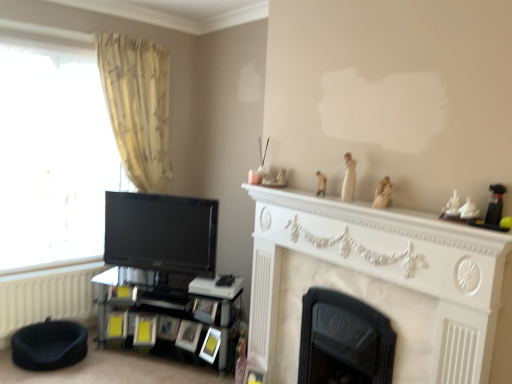
The height and width of the screenshot is (384, 512). In order to click on dark blue fabric bean bag chair at lower left in this screenshot , I will do `click(49, 345)`.

What is the approximate height of white textured radiator at lower left?

It is 17.04 inches.

Image resolution: width=512 pixels, height=384 pixels. What do you see at coordinates (48, 297) in the screenshot?
I see `white textured radiator at lower left` at bounding box center [48, 297].

Where is `beige textured curtain at left`? The height and width of the screenshot is (384, 512). beige textured curtain at left is located at coordinates (138, 106).

Measure the distance between beige textured curtain at left and camera.

beige textured curtain at left and camera are 2.94 meters apart.

At what (x,y) coordinates should I click in order to perform the action: click on white glossy statue at upper center, which is counted as the second toy, starting from the right. Please return your answer as a coordinate pair (x, y). The width and height of the screenshot is (512, 384). Looking at the image, I should click on (349, 178).

What are the coordinates of `dark blue fabric bean bag chair at lower left` in the screenshot? It's located at (49, 345).

How far apart are matte white figurine at upper center, placed as the first toy when sorted from back to front, and transparent glass window at left?

6.70 feet.

From the image's perspective, is matte white figurine at upper center, the third toy from the right, above transparent glass window at left?

No.

Which of these two, matte white figurine at upper center, the third toy from the right, or transparent glass window at left, is smaller?

Smaller between the two is matte white figurine at upper center, the third toy from the right.

Is matte white figurine at upper center, placed as the first toy when sorted from back to front, placed right next to transparent glass window at left?

matte white figurine at upper center, placed as the first toy when sorted from back to front, is not next to transparent glass window at left, and they're not touching.

Consider the image. Can you confirm if black glossy shelf at lower left is smaller than white marble fireplace at upper center?

No, black glossy shelf at lower left is not smaller than white marble fireplace at upper center.

Considering the relative sizes of black glossy shelf at lower left and white marble fireplace at upper center in the image provided, is black glossy shelf at lower left taller than white marble fireplace at upper center?

Indeed, black glossy shelf at lower left has a greater height compared to white marble fireplace at upper center.

From the image's perspective, which one is positioned lower, black glossy shelf at lower left or white marble fireplace at upper center?

black glossy shelf at lower left is shown below in the image.

Can you confirm if black glossy shelf at lower left is positioned to the right of white marble fireplace at upper center?

Incorrect, black glossy shelf at lower left is not on the right side of white marble fireplace at upper center.

Between white porcelain figurine at upper right and black glossy shelf at lower left, which one appears on the left side from the viewer's perspective?

From the viewer's perspective, black glossy shelf at lower left appears more on the left side.

From the image's perspective, is white porcelain figurine at upper right positioned above or below black glossy shelf at lower left?

white porcelain figurine at upper right is above black glossy shelf at lower left.

Does white porcelain figurine at upper right have a larger size compared to black glossy shelf at lower left?

Actually, white porcelain figurine at upper right might be smaller than black glossy shelf at lower left.

Is white porcelain figurine at upper right situated inside black glossy shelf at lower left or outside?

white porcelain figurine at upper right is outside black glossy shelf at lower left.

Locate an element on the screen. bean bag chair in front of the matte white picture frame at lower center, which is counted as the 1th picture frame, starting from the left is located at coordinates (49, 345).

Is dark blue fabric bean bag chair at lower left not close to matte white picture frame at lower center, which ranks as the first picture frame in back-to-front order?

They are positioned close to each other.

Do you think dark blue fabric bean bag chair at lower left is within matte white picture frame at lower center, which is counted as the 1th picture frame, starting from the left, or outside of it?

dark blue fabric bean bag chair at lower left is spatially situated outside matte white picture frame at lower center, which is counted as the 1th picture frame, starting from the left.

Between white textured radiator at lower left and white marble fireplace at center, marked as the second fireplace in a back-to-front arrangement, which one has less height?

Standing shorter between the two is white textured radiator at lower left.

Can you confirm if white textured radiator at lower left is thinner than white marble fireplace at center, which is the first fireplace in front-to-back order?

Yes, white textured radiator at lower left is thinner than white marble fireplace at center, which is the first fireplace in front-to-back order.

Is white textured radiator at lower left not inside white marble fireplace at center, which is the first fireplace in front-to-back order?

white textured radiator at lower left lies outside white marble fireplace at center, which is the first fireplace in front-to-back order,'s area.

Which object is closer to the camera taking this photo, white textured radiator at lower left or white marble fireplace at center, marked as the second fireplace in a back-to-front arrangement?

white marble fireplace at center, marked as the second fireplace in a back-to-front arrangement, is more forward.

Does matte white figurine at upper center, the third toy from the right, have a lesser width compared to white marble fireplace at center, marked as the second fireplace in a back-to-front arrangement?

Indeed, matte white figurine at upper center, the third toy from the right, has a lesser width compared to white marble fireplace at center, marked as the second fireplace in a back-to-front arrangement.

From the picture: Considering the sizes of objects matte white figurine at upper center, arranged as the 1th toy when viewed from the left, and white marble fireplace at center, marked as the second fireplace in a back-to-front arrangement, in the image provided, who is smaller, matte white figurine at upper center, arranged as the 1th toy when viewed from the left, or white marble fireplace at center, marked as the second fireplace in a back-to-front arrangement,?

With smaller size is matte white figurine at upper center, arranged as the 1th toy when viewed from the left.

Is matte white figurine at upper center, which is counted as the 3th toy, starting from the front, looking in the opposite direction of white marble fireplace at center, which is the first fireplace in front-to-back order?

matte white figurine at upper center, which is counted as the 3th toy, starting from the front, is not turned away from white marble fireplace at center, which is the first fireplace in front-to-back order.

Which of these two, white textured radiator at lower left or white marble fireplace at upper center, stands taller?

Standing taller between the two is white textured radiator at lower left.

Does white textured radiator at lower left turn towards white marble fireplace at upper center?

No, white textured radiator at lower left does not turn towards white marble fireplace at upper center.

Which object is wider, white textured radiator at lower left or white marble fireplace at upper center?

white marble fireplace at upper center.

Locate an element on the screen. The image size is (512, 384). window below the matte white figurine at upper center, the third toy from the right (from a real-world perspective) is located at coordinates (53, 157).

Image resolution: width=512 pixels, height=384 pixels. I want to click on shelf behind the white marble fireplace at upper center, so click(x=161, y=315).

When comparing their distances from black glossy tv at left, does white glossy statue at upper center, which appears as the second toy when viewed from the front, or white marble fireplace at center, marked as the second fireplace in a back-to-front arrangement, seem further?

Among the two, white glossy statue at upper center, which appears as the second toy when viewed from the front, is located further to black glossy tv at left.

Estimate the real-world distances between objects in this image. Which object is closer to beige textured curtain at left, black glossy shelf at lower left or dark blue fabric bean bag chair at lower left?

black glossy shelf at lower left is positioned closer to the anchor beige textured curtain at left.

Estimate the real-world distances between objects in this image. Which object is further from matte yellow picture frame at lower center, placed as the 1th picture frame when sorted from right to left, transparent glass window at left or white textured radiator at lower left?

Among the two, transparent glass window at left is located further to matte yellow picture frame at lower center, placed as the 1th picture frame when sorted from right to left.

Considering their positions, is matte white picture frame at lower center, the 2th picture frame viewed from the front, positioned closer to black cast iron fireplace at center, placed as the 2th fireplace when sorted from front to back, than dark blue fabric bean bag chair at lower left?

The object closer to black cast iron fireplace at center, placed as the 2th fireplace when sorted from front to back, is matte white picture frame at lower center, the 2th picture frame viewed from the front.

Considering their positions, is black glossy tv at left positioned closer to white porcelain figurine at upper right than white marble fireplace at center, marked as the second fireplace in a back-to-front arrangement?

The object closer to white porcelain figurine at upper right is white marble fireplace at center, marked as the second fireplace in a back-to-front arrangement.

From the image, which object appears to be nearer to transparent glass window at left, beige textured curtain at left or dark blue fabric bean bag chair at lower left?

beige textured curtain at left.

When comparing their distances from matte yellow picture frame at lower center, positioned as the second picture frame in back-to-front order, does white textured radiator at lower left or transparent glass window at left seem further?

transparent glass window at left is positioned further to the anchor matte yellow picture frame at lower center, positioned as the second picture frame in back-to-front order.

Estimate the real-world distances between objects in this image. Which object is further from white marble fireplace at upper center, matte white figurine at upper center, the third toy from the right, or matte yellow picture frame at lower center, positioned as the second picture frame in back-to-front order?

matte yellow picture frame at lower center, positioned as the second picture frame in back-to-front order, is positioned further to the anchor white marble fireplace at upper center.

This screenshot has width=512, height=384. Identify the location of television between dark blue fabric bean bag chair at lower left and matte white picture frame at lower center, positioned as the 2th picture frame in right-to-left order, from left to right. (161, 233).

The image size is (512, 384). I want to click on shelf between white textured radiator at lower left and white porcelain figurine at upper right from left to right, so click(x=161, y=315).

At what (x,y) coordinates should I click in order to perform the action: click on curtain between dark blue fabric bean bag chair at lower left and white glossy statue at upper center, placed as the 2th toy when sorted from back to front, from left to right. Please return your answer as a coordinate pair (x, y). This screenshot has height=384, width=512. Looking at the image, I should click on (138, 106).

Locate an element on the screen. The image size is (512, 384). television that lies between beige textured curtain at left and dark blue fabric bean bag chair at lower left from top to bottom is located at coordinates (161, 233).